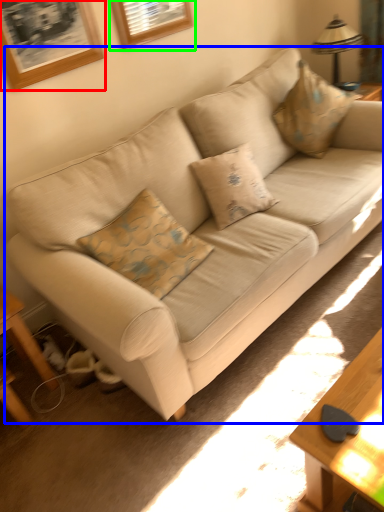
Question: Which object is the closest to the picture frame (highlighted by a red box)? Choose among these: studio couch (highlighted by a blue box) or picture frame (highlighted by a green box).

Choices:
 (A) studio couch
 (B) picture frame

Answer: (B)